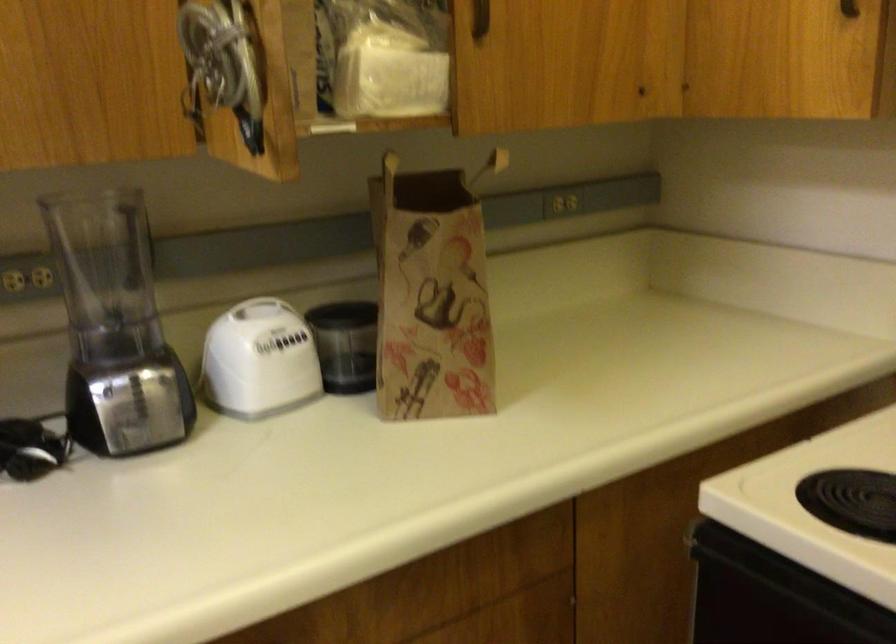
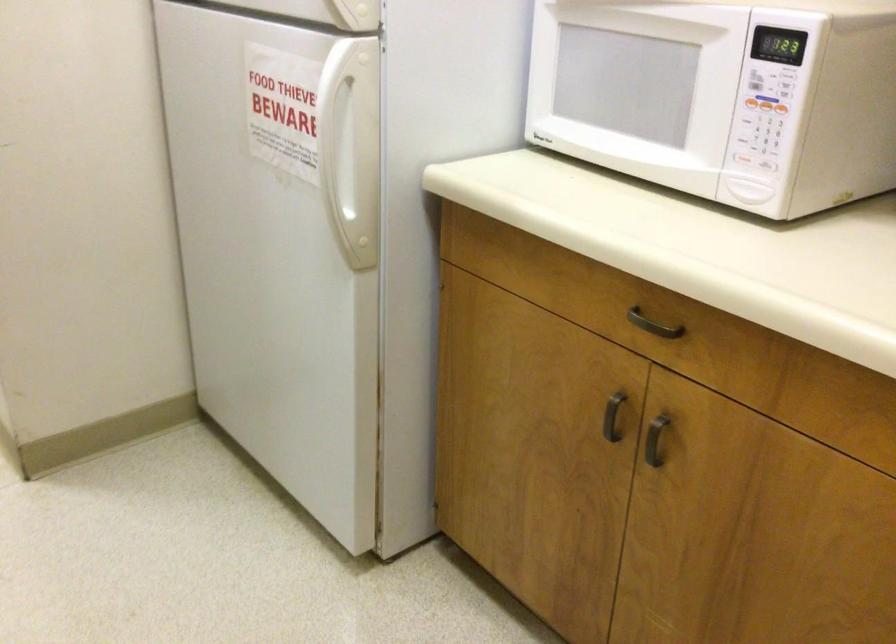
The images are taken continuously from a first-person perspective. In which direction is your viewpoint rotating?

The camera rotated toward left-down.